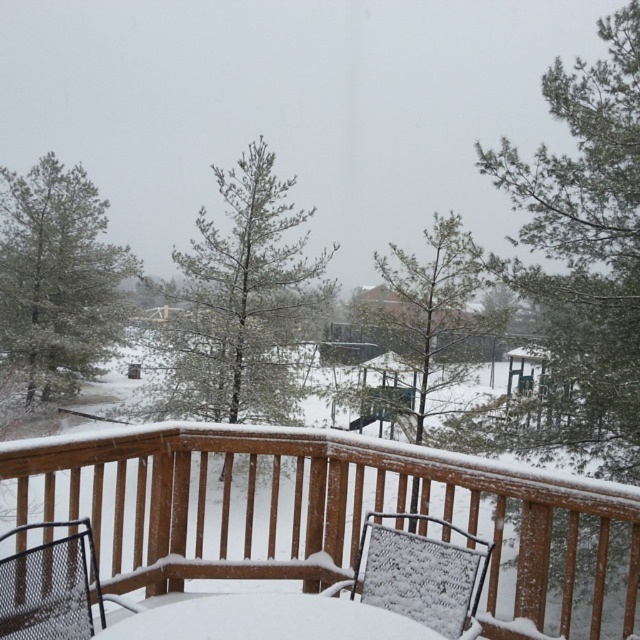
You are standing on the wooden deck and want to place a small snowman decoration between the green matte tree at center and the white mesh chair at center. Which object should the decoration be closer to based on their sizes?

The green matte tree at center is smaller than the white mesh chair at center, so the snowman decoration should be placed closer to the green matte tree at center to maintain proportion.

You are designing a winter landscape painting and want to ensure proper proportions between the green matte tree at center and the white mesh chair at center. According to the scene, which object is narrower?

The green matte tree at center is narrower than the white mesh chair at center.